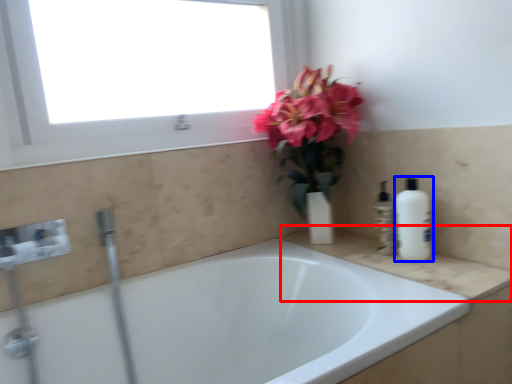
Question: Which point is closer to the camera, counter top (highlighted by a red box) or cleaning product (highlighted by a blue box)?

Choices:
 (A) counter top
 (B) cleaning product

Answer: (A)